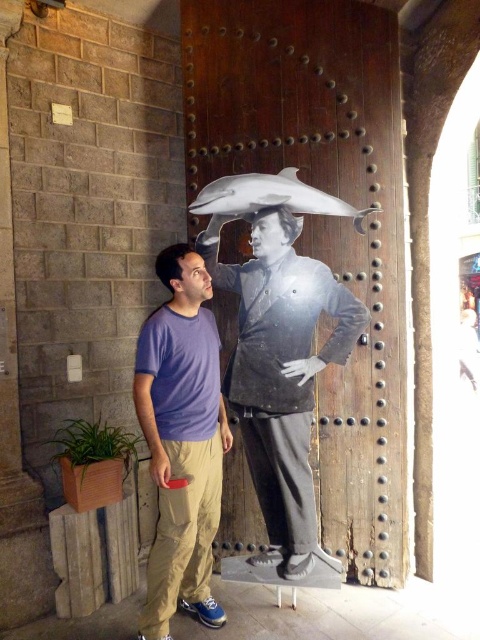
Does wooden at upper center have a larger size compared to purple cotton t-shirt at center?

Correct, wooden at upper center is larger in size than purple cotton t-shirt at center.

Which is more to the right, wooden at upper center or purple cotton t-shirt at center?

From the viewer's perspective, wooden at upper center appears more on the right side.

Where is `wooden at upper center`? wooden at upper center is located at coordinates (323, 224).